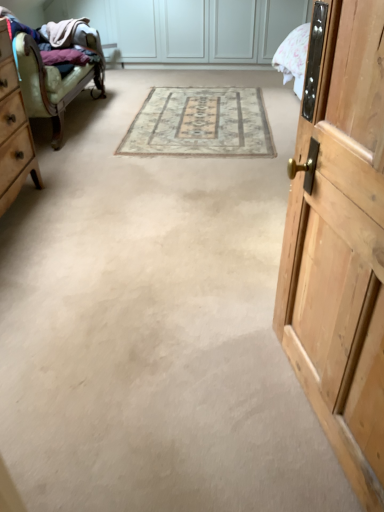
Where is `leather armchair at left`? The height and width of the screenshot is (512, 384). leather armchair at left is located at coordinates (56, 81).

Identify the location of wooden dresser at left. point(13,130).

Does leather armchair at left have a greater width compared to wooden door at right?

Yes.

Can you confirm if leather armchair at left is bigger than wooden door at right?

Correct, leather armchair at left is larger in size than wooden door at right.

Considering the sizes of objects leather armchair at left and wooden door at right in the image provided, who is shorter, leather armchair at left or wooden door at right?

With less height is leather armchair at left.

Consider the image. Looking at their sizes, would you say beige carpet at center is wider or thinner than wooden door at right?

Considering their sizes, beige carpet at center looks broader than wooden door at right.

Is beige carpet at center not within wooden door at right?

Absolutely, beige carpet at center is external to wooden door at right.

Considering the relative sizes of beige carpet at center and wooden door at right in the image provided, is beige carpet at center smaller than wooden door at right?

Yes, beige carpet at center is smaller than wooden door at right.

Is beige carpet at center behind wooden door at right?

Yes, beige carpet at center is behind wooden door at right.

In terms of size, does wooden door at right appear bigger or smaller than leather armchair at left?

Considering their sizes, wooden door at right takes up less space than leather armchair at left.

Considering the relative positions of wooden door at right and leather armchair at left in the image provided, is wooden door at right to the left or to the right of leather armchair at left?

wooden door at right is to the right of leather armchair at left.

From a real-world perspective, who is located lower, wooden door at right or leather armchair at left?

leather armchair at left is physically lower.

Considering the relative sizes of leather armchair at left and wooden dresser at left in the image provided, is leather armchair at left taller than wooden dresser at left?

No.

How distant is leather armchair at left from wooden dresser at left?

The distance of leather armchair at left from wooden dresser at left is 31.25 inches.

Does leather armchair at left appear on the right side of wooden dresser at left?

No.

What's the angular difference between leather armchair at left and wooden dresser at left's facing directions?

The facing directions of leather armchair at left and wooden dresser at left are 0.000655 degrees apart.

Could you tell me if wooden dresser at left is turned towards leather armchair at left?

No.

Does wooden dresser at left lie behind leather armchair at left?

No, it is not.

Does wooden dresser at left have a greater height compared to leather armchair at left?

Indeed, wooden dresser at left has a greater height compared to leather armchair at left.

Is beige carpet at center located within leather armchair at left?

No, beige carpet at center is not inside leather armchair at left.

From the image's perspective, which is below, leather armchair at left or beige carpet at center?

beige carpet at center appears lower in the image.

Where is `mat that appears behind the leather armchair at left`? The height and width of the screenshot is (512, 384). mat that appears behind the leather armchair at left is located at coordinates (200, 123).

In the scene shown: Which object is wider, leather armchair at left or beige carpet at center?

beige carpet at center.

You are a GUI agent. You are given a task and a screenshot of the screen. Output one action in this format:
    pyautogui.click(x=<x>, y=<y>)
    Task: Click on the door located on the right of wooden dresser at left
    The width and height of the screenshot is (384, 512).
    Given the screenshot: What is the action you would take?
    pyautogui.click(x=340, y=242)

Is point (377, 155) closer or farther from the camera than point (18, 142)?

Clearly, point (377, 155) is closer to the camera than point (18, 142).

From the picture: Considering the sizes of objects wooden door at right and wooden dresser at left in the image provided, who is wider, wooden door at right or wooden dresser at left?

wooden dresser at left is wider.

Considering the relative sizes of wooden door at right and wooden dresser at left in the image provided, is wooden door at right bigger than wooden dresser at left?

Actually, wooden door at right might be smaller than wooden dresser at left.

What are the coordinates of `chair lying on the left of wooden door at right` in the screenshot? It's located at (56, 81).

You are a GUI agent. You are given a task and a screenshot of the screen. Output one action in this format:
    pyautogui.click(x=<x>, y=<y>)
    Task: Click on the door lying below the beige carpet at center (from the image's perspective)
    The image size is (384, 512).
    Given the screenshot: What is the action you would take?
    pyautogui.click(x=340, y=242)

From the picture: Estimate the real-world distances between objects in this image. Which object is further from wooden dresser at left, wooden door at right or leather armchair at left?

The object further to wooden dresser at left is wooden door at right.

Estimate the real-world distances between objects in this image. Which object is further from leather armchair at left, wooden dresser at left or beige carpet at center?

Among the two, beige carpet at center is located further to leather armchair at left.

Based on their spatial positions, is wooden door at right or beige carpet at center further from wooden dresser at left?

wooden door at right.

Considering their positions, is wooden door at right positioned further to beige carpet at center than wooden dresser at left?

wooden door at right lies further to beige carpet at center than the other object.

Considering their positions, is beige carpet at center positioned further to wooden door at right than leather armchair at left?

leather armchair at left is positioned further to the anchor wooden door at right.

Which object lies nearer to the anchor point wooden dresser at left, leather armchair at left or wooden door at right?

leather armchair at left.

Based on their spatial positions, is beige carpet at center or wooden door at right further from wooden dresser at left?

Among the two, wooden door at right is located further to wooden dresser at left.

Estimate the real-world distances between objects in this image. Which object is closer to wooden door at right, leather armchair at left or wooden dresser at left?

wooden dresser at left is closer to wooden door at right.

Where is `cabinetry between wooden door at right and leather armchair at left along the z-axis`? cabinetry between wooden door at right and leather armchair at left along the z-axis is located at coordinates (13, 130).

Identify the location of cabinetry between wooden door at right and beige carpet at center along the z-axis. The image size is (384, 512). (13, 130).

You are a GUI agent. You are given a task and a screenshot of the screen. Output one action in this format:
    pyautogui.click(x=<x>, y=<y>)
    Task: Click on the chair located between wooden dresser at left and beige carpet at center in the depth direction
    Image resolution: width=384 pixels, height=512 pixels.
    Given the screenshot: What is the action you would take?
    pyautogui.click(x=56, y=81)

Where is `chair between wooden door at right and beige carpet at center in the front-back direction`? chair between wooden door at right and beige carpet at center in the front-back direction is located at coordinates (56, 81).